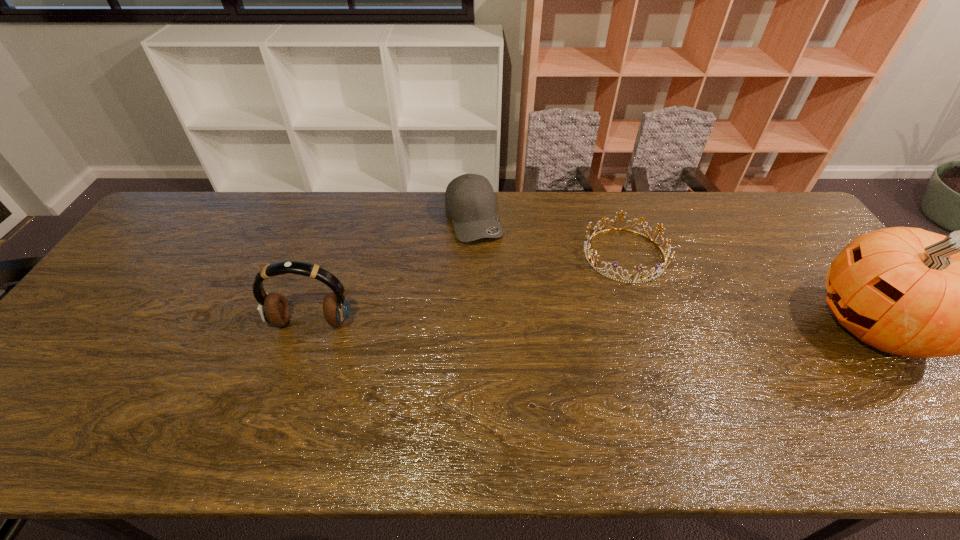
The height and width of the screenshot is (540, 960). I want to click on blank area located 0.220m on the front-facing side of the shortest object, so click(x=652, y=351).

This screenshot has height=540, width=960. Find the location of `vacant space situated 0.110m on the front-facing side of the shortest object`. vacant space situated 0.110m on the front-facing side of the shortest object is located at coordinates (642, 317).

This screenshot has height=540, width=960. I want to click on vacant space situated on the front-facing side of the shortest object, so click(644, 322).

The image size is (960, 540). What are the coordinates of `baseball cap that is at the far edge` in the screenshot? It's located at (470, 202).

Locate an element on the screen. Image resolution: width=960 pixels, height=540 pixels. tiara positioned at the far edge is located at coordinates (642, 279).

Identify the location of vacant space at the far edge of the desktop. This screenshot has width=960, height=540. (329, 224).

This screenshot has height=540, width=960. Find the location of `free space at the near edge of the desktop`. free space at the near edge of the desktop is located at coordinates (204, 409).

This screenshot has height=540, width=960. In the image, there is a desktop. Identify the location of free region at the left edge. (90, 360).

The width and height of the screenshot is (960, 540). In the image, there is a desktop. Find the location of `free space at the right edge`. free space at the right edge is located at coordinates (805, 242).

The width and height of the screenshot is (960, 540). In the image, there is a desktop. In order to click on free region at the far left corner in this screenshot , I will do [175, 232].